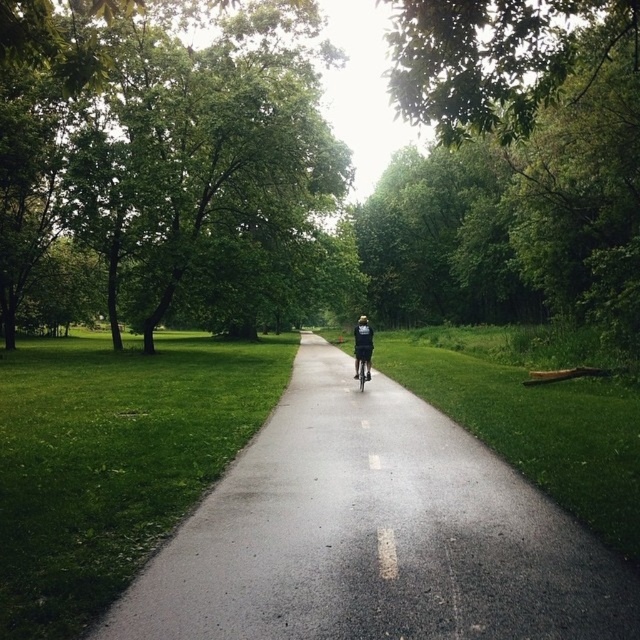
Question: Is green leafy tree at center below matte black bicycle at center?

Choices:
 (A) yes
 (B) no

Answer: (B)

Question: Can you confirm if green leafy tree at upper left is positioned above matte black bicycle at center?

Choices:
 (A) yes
 (B) no

Answer: (A)

Question: Among these objects, which one is farthest from the camera?

Choices:
 (A) green leafy tree at upper left
 (B) matte black bicycle at center
 (C) black asphalt path at center

Answer: (B)

Question: Which object is farther from the camera taking this photo?

Choices:
 (A) green leafy tree at center
 (B) black fabric jacket at center
 (C) matte black bicycle at center
 (D) green leafy tree at upper left

Answer: (B)

Question: Observing the image, what is the correct spatial positioning of green leafy tree at upper left in reference to black fabric jacket at center?

Choices:
 (A) right
 (B) left

Answer: (B)

Question: Which object appears closest to the camera in this image?

Choices:
 (A) green leafy tree at center
 (B) matte black bicycle at center
 (C) green leafy tree at upper left
 (D) black fabric jacket at center

Answer: (C)